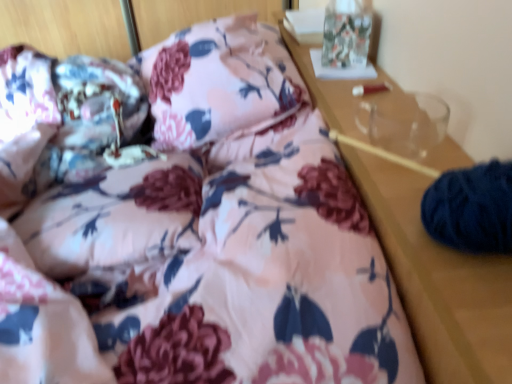
Question: Are dark blue yarn at right, the first pillow positioned from the bottom, and floral fabric pillow at center, arranged as the 2th pillow when viewed from the right, far apart?

Choices:
 (A) yes
 (B) no

Answer: (B)

Question: From a real-world perspective, is dark blue yarn at right, the 2th pillow from the left, located higher than floral fabric pillow at center, arranged as the 2th pillow when viewed from the front?

Choices:
 (A) yes
 (B) no

Answer: (A)

Question: Can you confirm if dark blue yarn at right, the second pillow from the back, is positioned to the right of floral fabric pillow at center, arranged as the 2th pillow when viewed from the front?

Choices:
 (A) yes
 (B) no

Answer: (A)

Question: From the image's perspective, would you say dark blue yarn at right, positioned as the first pillow in right-to-left order, is shown under floral fabric pillow at center, arranged as the 2th pillow when viewed from the front?

Choices:
 (A) yes
 (B) no

Answer: (A)

Question: Is dark blue yarn at right, the first pillow positioned from the bottom, smaller than floral fabric pillow at center, marked as the first pillow in a top-to-bottom arrangement?

Choices:
 (A) no
 (B) yes

Answer: (B)

Question: Considering the relative sizes of dark blue yarn at right, the second pillow viewed from the top, and floral fabric pillow at center, arranged as the 2th pillow when viewed from the right, in the image provided, is dark blue yarn at right, the second pillow viewed from the top, wider than floral fabric pillow at center, arranged as the 2th pillow when viewed from the right,?

Choices:
 (A) yes
 (B) no

Answer: (B)

Question: Is the depth of floral fabric pillow at center, which appears as the 1th pillow when viewed from the back, less than that of dark blue yarn at right, positioned as the first pillow in front-to-back order?

Choices:
 (A) no
 (B) yes

Answer: (A)

Question: Is dark blue yarn at right, the second pillow viewed from the top, completely or partially inside floral fabric pillow at center, the 2th pillow from the bottom?

Choices:
 (A) yes
 (B) no

Answer: (B)

Question: Is there a large distance between floral fabric pillow at center, marked as the first pillow in a top-to-bottom arrangement, and dark blue yarn at right, the 2th pillow from the left?

Choices:
 (A) no
 (B) yes

Answer: (A)

Question: Is floral fabric pillow at center, marked as the first pillow in a top-to-bottom arrangement, behind dark blue yarn at right, positioned as the first pillow in front-to-back order?

Choices:
 (A) no
 (B) yes

Answer: (B)

Question: Does floral fabric pillow at center, arranged as the 2th pillow when viewed from the right, have a larger size compared to dark blue yarn at right, the second pillow from the back?

Choices:
 (A) no
 (B) yes

Answer: (B)

Question: Is floral fabric pillow at center, arranged as the 2th pillow when viewed from the front, next to dark blue yarn at right, the 2th pillow from the left, and touching it?

Choices:
 (A) yes
 (B) no

Answer: (B)

Question: Is dark blue yarn at right, the second pillow viewed from the top, wider or thinner than floral fabric pillow at center, arranged as the 2th pillow when viewed from the front?

Choices:
 (A) thin
 (B) wide

Answer: (A)